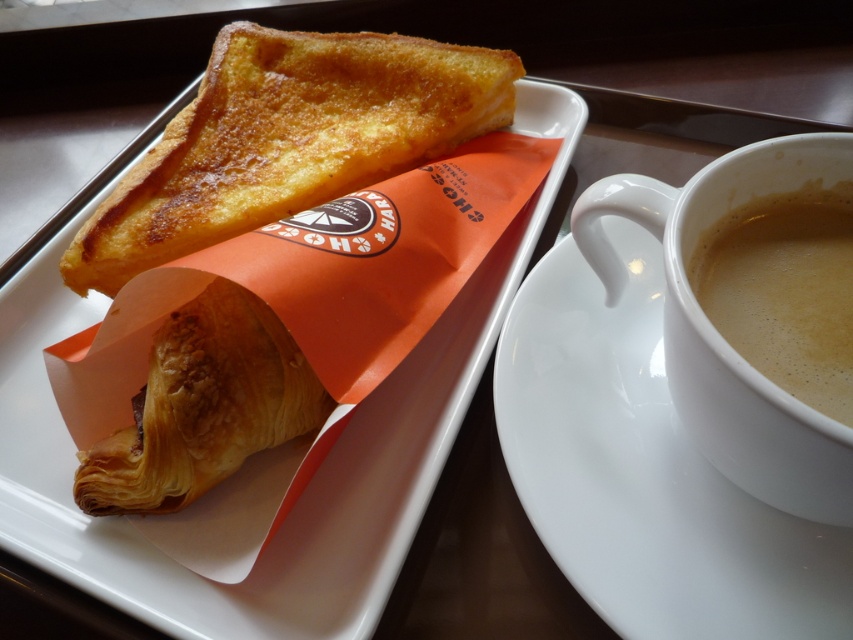
Who is taller, white ceramic saucer at right or brown frothy coffee at right?

Standing taller between the two is white ceramic saucer at right.

I want to click on white ceramic saucer at right, so click(x=643, y=470).

Which is behind, point (635, 352) or point (817, 248)?

The point (635, 352) is more distant.

Locate an element on the screen. white ceramic saucer at right is located at coordinates (643, 470).

Is matte white plate at upper left wider than golden brown flaky croissant at lower left?

Yes.

Does matte white plate at upper left come behind golden brown flaky croissant at lower left?

No.

Locate an element on the screen. The image size is (853, 640). matte white plate at upper left is located at coordinates (308, 483).

Who is higher up, golden brown flaky croissant at upper left or brown frothy coffee at right?

Positioned higher is golden brown flaky croissant at upper left.

Who is taller, golden brown flaky croissant at upper left or brown frothy coffee at right?

Standing taller between the two is golden brown flaky croissant at upper left.

Where is `golden brown flaky croissant at upper left`? This screenshot has width=853, height=640. golden brown flaky croissant at upper left is located at coordinates (287, 138).

You are a GUI agent. You are given a task and a screenshot of the screen. Output one action in this format:
    pyautogui.click(x=<x>, y=<y>)
    Task: Click on the golden brown flaky croissant at upper left
    The height and width of the screenshot is (640, 853).
    Given the screenshot: What is the action you would take?
    pyautogui.click(x=287, y=138)